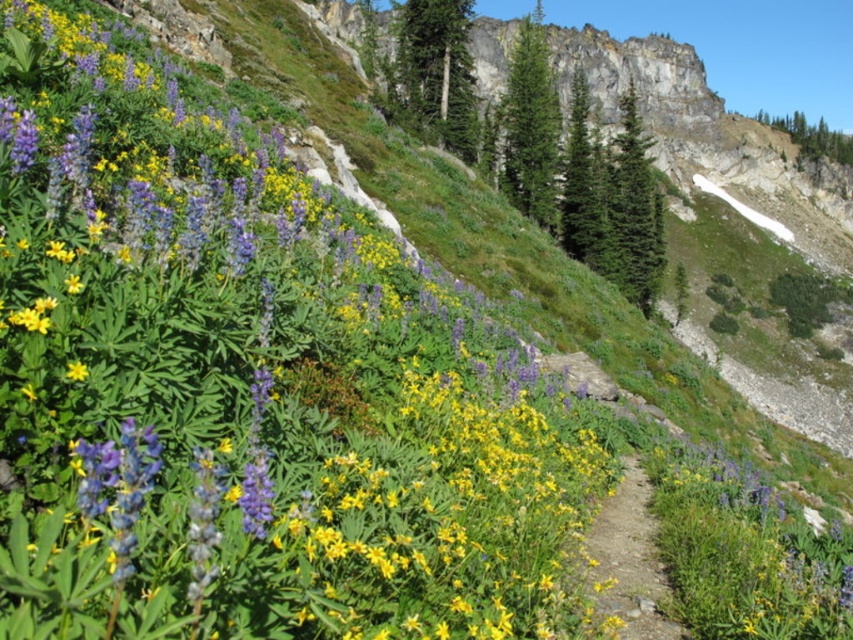
You are a hiker who wants to take a photo of the purple matte flower at upper left and the dirt path at center. Which object should you focus on first if you want to capture both in the same frame without moving your camera?

The purple matte flower at upper left is taller than the dirt path at center, so you should focus on the purple matte flower at upper left first to ensure both are in focus.

You are a hiker standing at the starting point of the narrow dirt path. You see a purple matte flower at upper left. Can you reach it within 10 meters of walking distance?

The purple matte flower at upper left is 8.99 meters away from camera, so yes, you can reach it within 10 meters of walking distance.